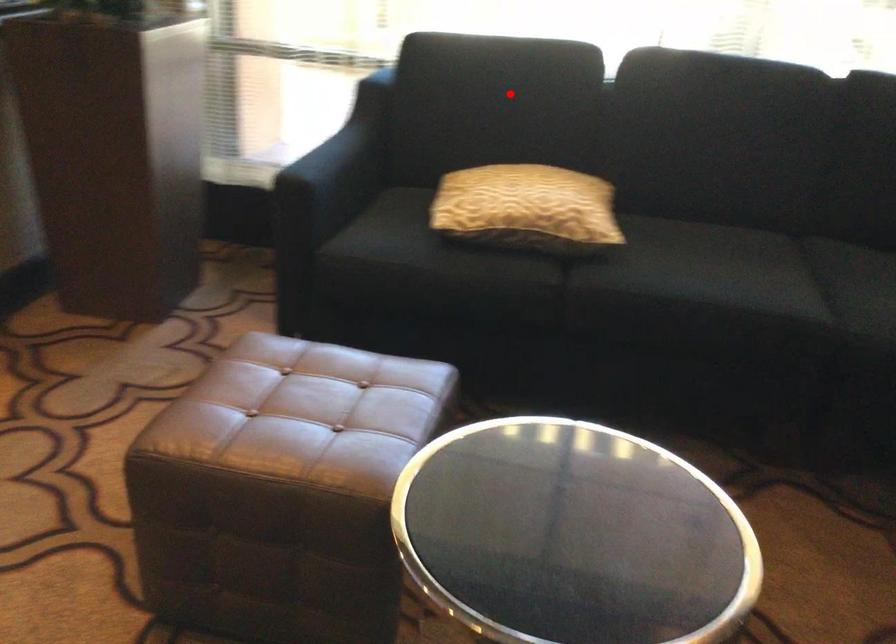
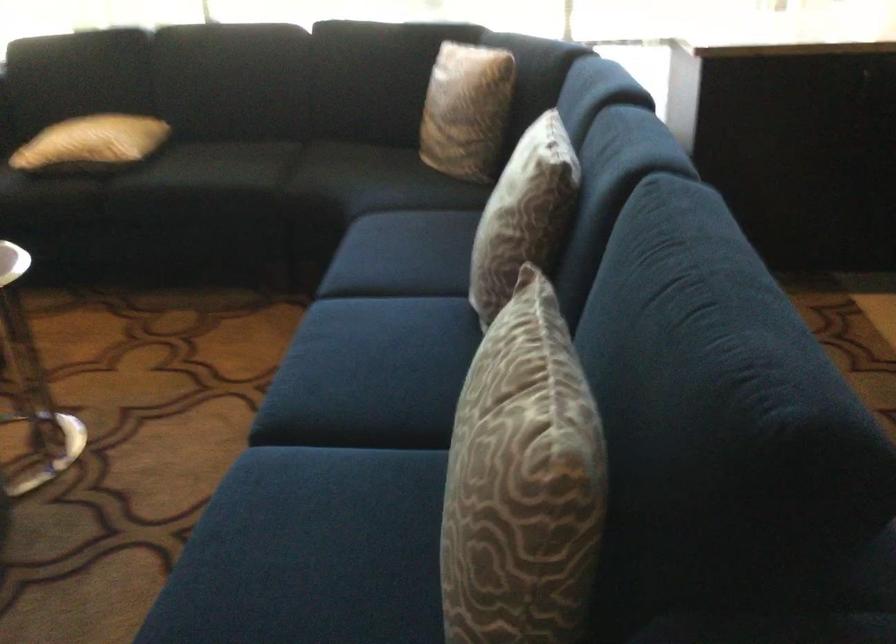
Locate, in the second image, the point that corresponds to the highlighted location in the first image.

(82, 64)